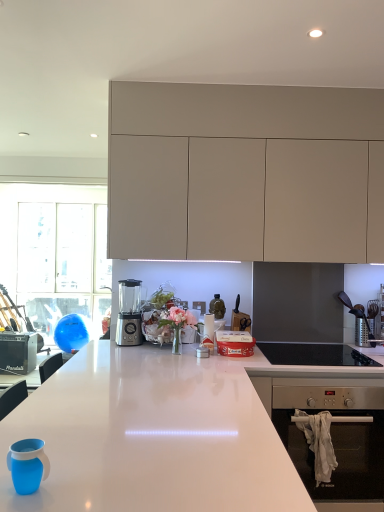
Identify the location of vacant area that is in front of sleek metallic blender at center. (123, 348).